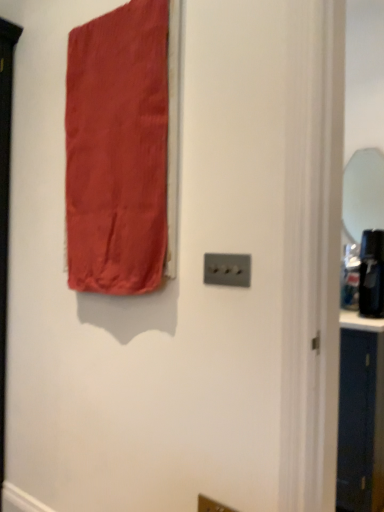
Question: Does point (349, 195) appear closer or farther from the camera than point (233, 265)?

Choices:
 (A) closer
 (B) farther

Answer: (B)

Question: In the image, is clear glass mirror at right on the left side or the right side of satin silver light switch at center?

Choices:
 (A) right
 (B) left

Answer: (A)

Question: Based on their relative distances, which object is nearer to the satin red curtain at upper left?

Choices:
 (A) satin silver light switch at center
 (B) clear glass mirror at right

Answer: (A)

Question: Estimate the real-world distances between objects in this image. Which object is closer to the satin silver light switch at center?

Choices:
 (A) clear glass mirror at right
 (B) satin red curtain at upper left

Answer: (B)